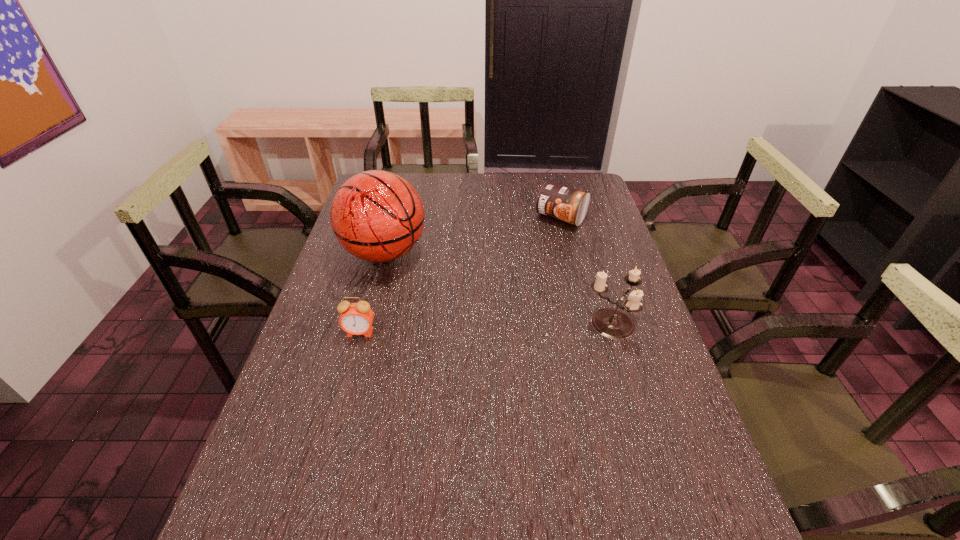
Where is `free space that is in between the can and the third shortest object`? This screenshot has height=540, width=960. free space that is in between the can and the third shortest object is located at coordinates (586, 271).

The image size is (960, 540). Find the location of `free spot between the alarm clock and the tallest object`. free spot between the alarm clock and the tallest object is located at coordinates (372, 293).

You are a GUI agent. You are given a task and a screenshot of the screen. Output one action in this format:
    pyautogui.click(x=<x>, y=<y>)
    Task: Click on the unoccupied position between the alarm clock and the second tallest object
    The width and height of the screenshot is (960, 540).
    Given the screenshot: What is the action you would take?
    pyautogui.click(x=485, y=329)

Locate an element on the screen. This screenshot has height=540, width=960. free space between the tallest object and the alarm clock is located at coordinates (372, 293).

Locate an element on the screen. The image size is (960, 540). object that is the closest to the can is located at coordinates (612, 323).

This screenshot has height=540, width=960. I want to click on object that ranks as the third closest to the tallest object, so click(x=612, y=323).

You are a GUI agent. You are given a task and a screenshot of the screen. Output one action in this format:
    pyautogui.click(x=<x>, y=<y>)
    Task: Click on the blank area in the image that satisfies the following two spatial constraints: 1. on the front side of the candle holder; 2. on the left side of the can
    The image size is (960, 540).
    Given the screenshot: What is the action you would take?
    pyautogui.click(x=588, y=325)